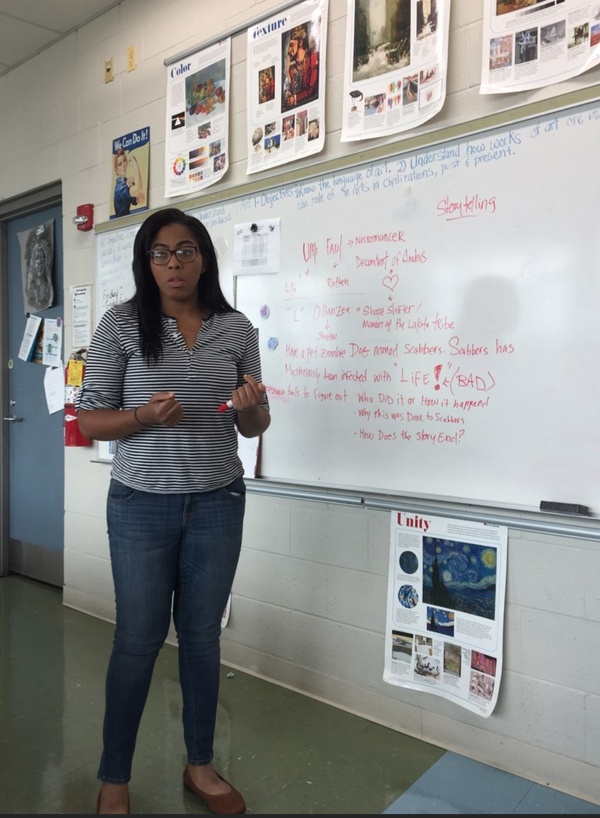
I want to click on white board, so click(x=545, y=472).